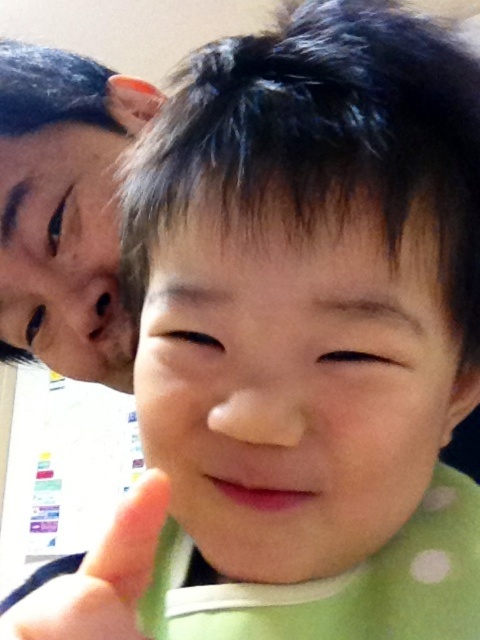
Between point (28, 168) and point (275, 486), which one is positioned behind?

Point (28, 168)

Between matte black hair at upper left and pink matte mouth at center, which one is positioned lower?

pink matte mouth at center

Who is more forward, (32, 220) or (284, 490)?

Point (284, 490) is in front.

The image size is (480, 640). What are the coordinates of `matte black hair at upper left` in the screenshot? It's located at (66, 211).